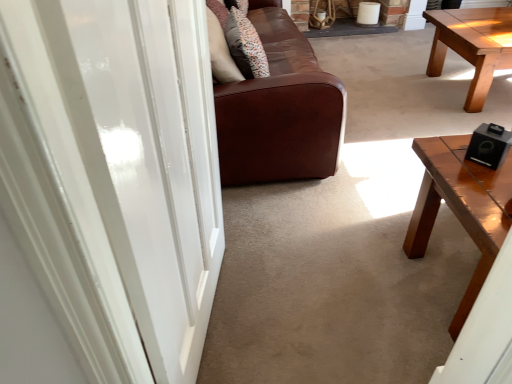
At what (x,y) coordinates should I click in order to perform the action: click on free spot to the left of shiny brown wood coffee table at right. Please return your answer as a coordinate pair (x, y). The image size is (512, 384). Looking at the image, I should click on (351, 294).